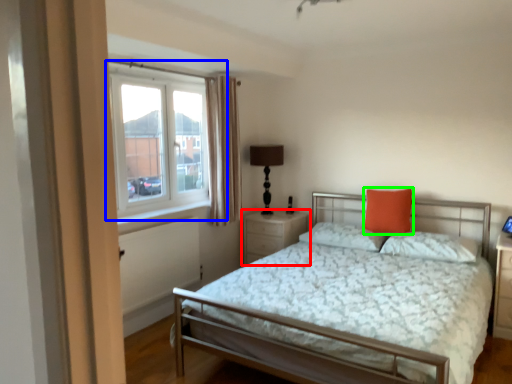
Question: Which object is the closest to the nightstand (highlighted by a red box)? Choose among these: window (highlighted by a blue box) or pillow (highlighted by a green box).

Choices:
 (A) window
 (B) pillow

Answer: (B)